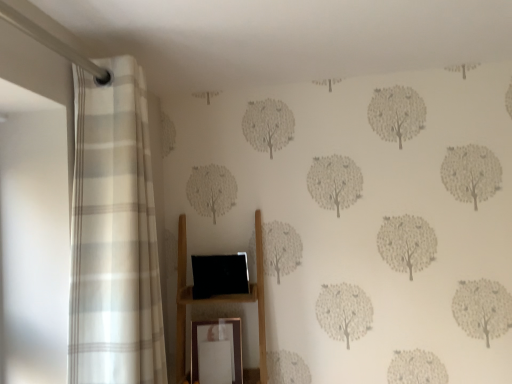
Question: Does gold metallic picture frame at lower center come in front of white striped curtain at left?

Choices:
 (A) no
 (B) yes

Answer: (A)

Question: Is there a large distance between gold metallic picture frame at lower center and white striped curtain at left?

Choices:
 (A) yes
 (B) no

Answer: (B)

Question: Does gold metallic picture frame at lower center have a greater height compared to white striped curtain at left?

Choices:
 (A) yes
 (B) no

Answer: (B)

Question: Considering the relative positions of gold metallic picture frame at lower center and white striped curtain at left in the image provided, is gold metallic picture frame at lower center to the left of white striped curtain at left from the viewer's perspective?

Choices:
 (A) yes
 (B) no

Answer: (B)

Question: Can you confirm if gold metallic picture frame at lower center is wider than white striped curtain at left?

Choices:
 (A) yes
 (B) no

Answer: (B)

Question: Is gold metallic picture frame at lower center smaller than white striped curtain at left?

Choices:
 (A) no
 (B) yes

Answer: (B)

Question: From a real-world perspective, is gold metallic picture frame at lower center located higher than wooden shelf at center?

Choices:
 (A) yes
 (B) no

Answer: (B)

Question: Is gold metallic picture frame at lower center bigger than wooden shelf at center?

Choices:
 (A) yes
 (B) no

Answer: (B)

Question: Does gold metallic picture frame at lower center have a smaller size compared to wooden shelf at center?

Choices:
 (A) no
 (B) yes

Answer: (B)

Question: Considering the relative positions of gold metallic picture frame at lower center and wooden shelf at center in the image provided, is gold metallic picture frame at lower center to the left of wooden shelf at center from the viewer's perspective?

Choices:
 (A) no
 (B) yes

Answer: (A)

Question: From the image's perspective, is gold metallic picture frame at lower center located above wooden shelf at center?

Choices:
 (A) yes
 (B) no

Answer: (B)

Question: Can you confirm if gold metallic picture frame at lower center is positioned to the right of wooden shelf at center?

Choices:
 (A) yes
 (B) no

Answer: (A)

Question: Is white striped curtain at left positioned far away from wooden shelf at center?

Choices:
 (A) no
 (B) yes

Answer: (A)